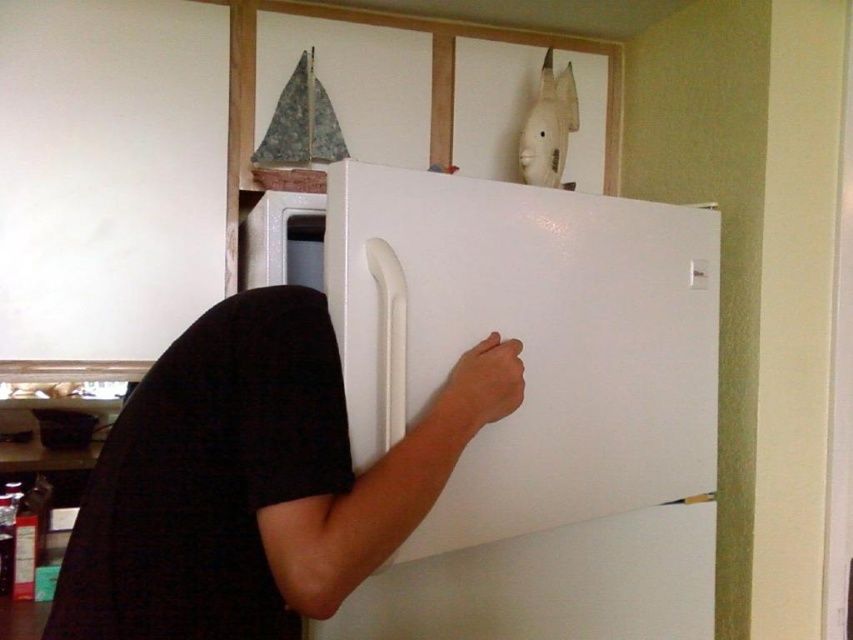
Question: Which point is farther to the camera?

Choices:
 (A) black matte shirt at center
 (B) white glossy refrigerator at center

Answer: (B)

Question: From the image, what is the correct spatial relationship of white glossy refrigerator at center in relation to black matte shirt at center?

Choices:
 (A) above
 (B) below

Answer: (A)

Question: Considering the relative positions of white glossy refrigerator at center and black matte shirt at center in the image provided, where is white glossy refrigerator at center located with respect to black matte shirt at center?

Choices:
 (A) above
 (B) below

Answer: (A)

Question: In this image, where is white glossy refrigerator at center located relative to black matte shirt at center?

Choices:
 (A) right
 (B) left

Answer: (A)